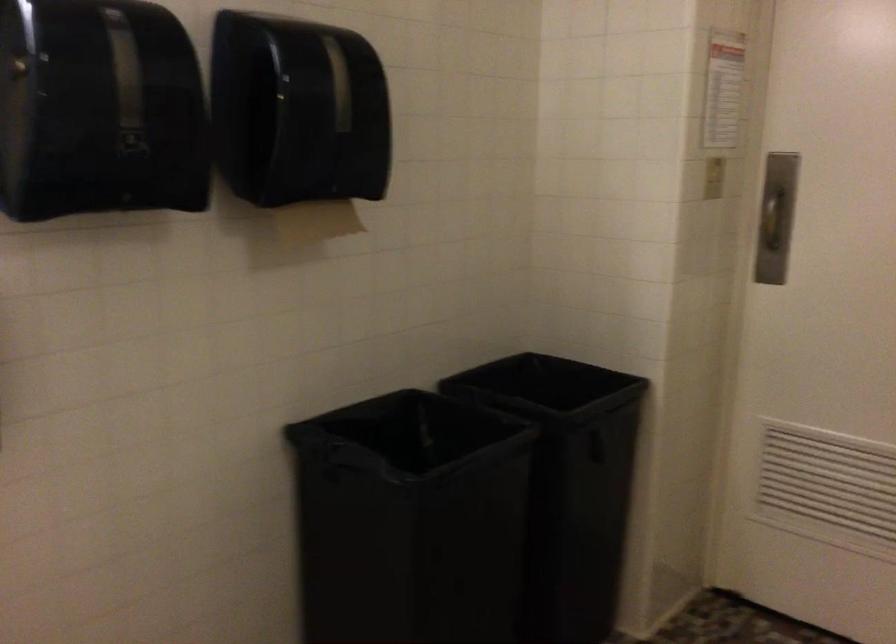
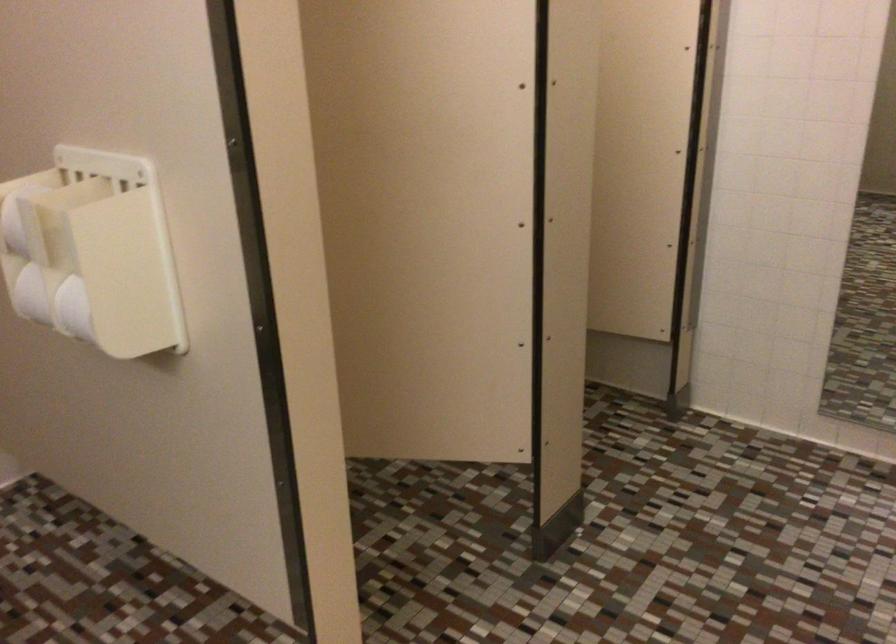
Based on the continuous images, in which direction is the camera rotating?

The camera's rotation is toward right-down.